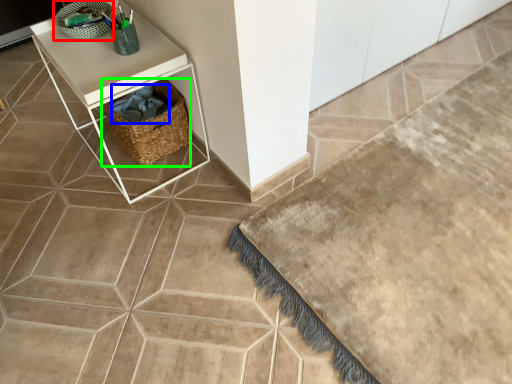
Question: Which object is positioned closest to basket (highlighted by a red box)? Select from material (highlighted by a blue box) and basket (highlighted by a green box).

Choices:
 (A) material
 (B) basket

Answer: (A)